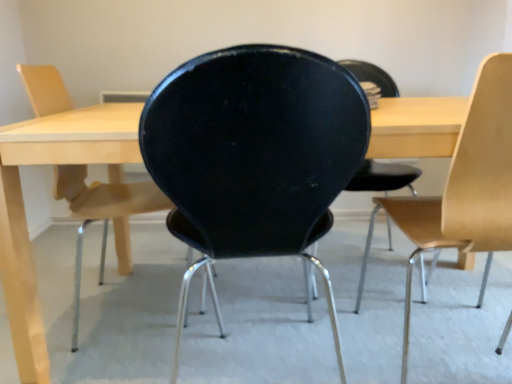
The height and width of the screenshot is (384, 512). I want to click on vacant space to the right of matte black chair at center, marked as the third chair in a right-to-left arrangement, so coord(232,306).